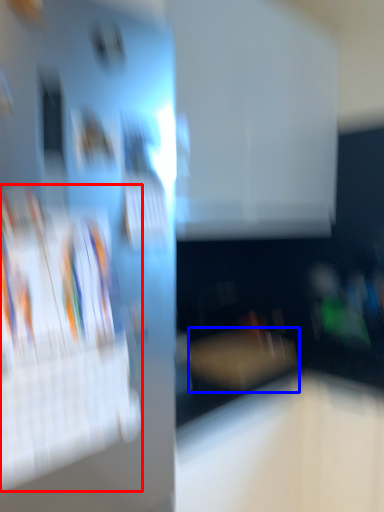
Question: Among these objects, which one is nearest to the camera, magazine (highlighted by a red box) or furniture (highlighted by a blue box)?

Choices:
 (A) magazine
 (B) furniture

Answer: (A)